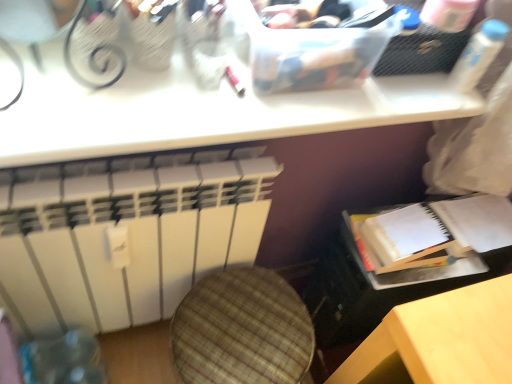
Question: Considering their positions, is plaid fabric swivel chair at lower left located in front of or behind white matte radiator at lower left?

Choices:
 (A) behind
 (B) front

Answer: (A)

Question: Considering the positions of plaid fabric swivel chair at lower left and white matte radiator at lower left in the image, is plaid fabric swivel chair at lower left taller or shorter than white matte radiator at lower left?

Choices:
 (A) tall
 (B) short

Answer: (B)

Question: Estimate the real-world distances between objects in this image. Which object is farther from the white plastic bottle at upper right?

Choices:
 (A) white matte radiator at lower left
 (B) white plastic table at upper center
 (C) plaid fabric swivel chair at lower left
 (D) white paper journal at lower right

Answer: (A)

Question: Which object is positioned closest to the white plastic table at upper center?

Choices:
 (A) white matte radiator at lower left
 (B) plaid fabric swivel chair at lower left
 (C) white paper journal at lower right
 (D) white plastic bottle at upper right

Answer: (A)